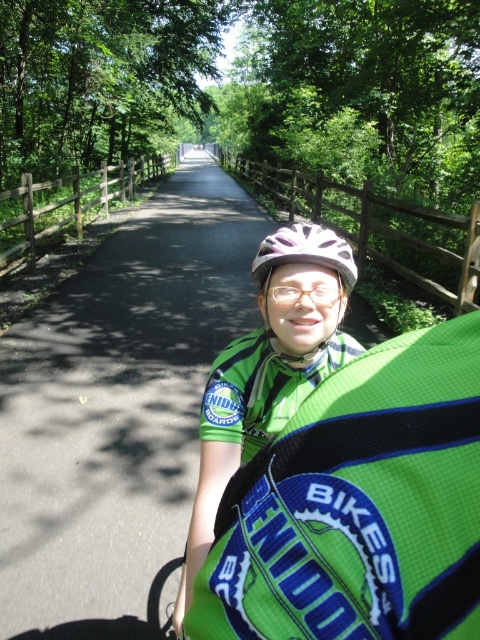
Question: Which object is positioned closest to the white matte bicycle helmet at center?

Choices:
 (A) green mesh vest at center
 (B) black asphalt path at center
 (C) clear plastic goggles at center

Answer: (C)

Question: In this image, where is green mesh vest at center located relative to clear plastic goggles at center?

Choices:
 (A) below
 (B) above

Answer: (A)

Question: Which point is closer to the camera taking this photo?

Choices:
 (A) (322, 305)
 (B) (275, 428)
 (C) (331, 260)

Answer: (C)

Question: Can you confirm if green mesh vest at center is bigger than clear plastic goggles at center?

Choices:
 (A) yes
 (B) no

Answer: (A)

Question: Is white matte bicycle helmet at center behind clear plastic goggles at center?

Choices:
 (A) no
 (B) yes

Answer: (A)

Question: Which of the following is the farthest from the observer?

Choices:
 (A) (133, 321)
 (B) (286, 301)
 (C) (288, 234)

Answer: (A)